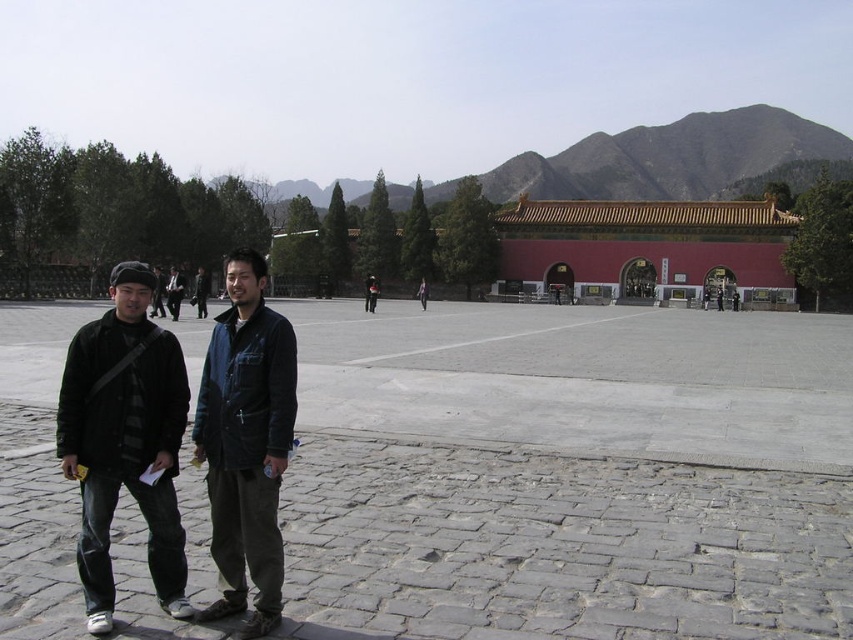
Is black matte jacket at left to the right of dark blue jacket at center from the viewer's perspective?

Yes, black matte jacket at left is to the right of dark blue jacket at center.

Who is lower down, black matte jacket at left or dark blue jacket at center?

black matte jacket at left is below.

You are a GUI agent. You are given a task and a screenshot of the screen. Output one action in this format:
    pyautogui.click(x=<x>, y=<y>)
    Task: Click on the black matte jacket at left
    The height and width of the screenshot is (640, 853).
    Given the screenshot: What is the action you would take?
    pyautogui.click(x=125, y=440)

Locate an element on the screen. The image size is (853, 640). black matte jacket at left is located at coordinates (125, 440).

Which is in front, point (192, 438) or point (177, 276)?

Point (192, 438) is in front.

Is denim jacket at center further to the viewer compared to dark blue denim jacket at center?

That is False.

Measure the distance between denim jacket at center and camera.

They are 9.05 meters apart.

Where is `denim jacket at center`? The width and height of the screenshot is (853, 640). denim jacket at center is located at coordinates (247, 442).

Who is taller, denim jacket at center or dark blue jacket at center?

With more height is dark blue jacket at center.

Is point (251, 627) closer to camera compared to point (155, 282)?

Yes, it is.

Which is behind, point (250, 518) or point (157, 310)?

Positioned behind is point (157, 310).

Locate an element on the screen. Image resolution: width=853 pixels, height=640 pixels. denim jacket at center is located at coordinates (247, 442).